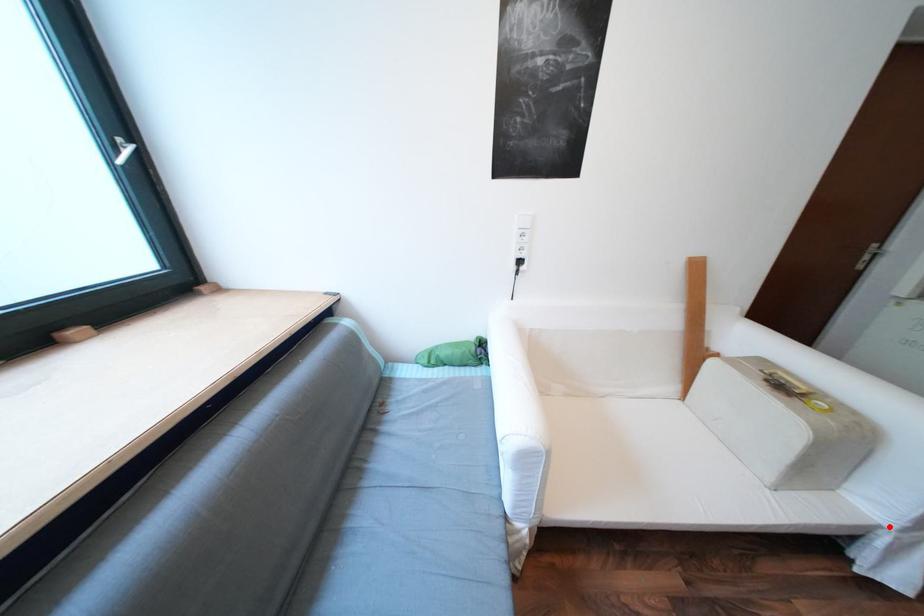
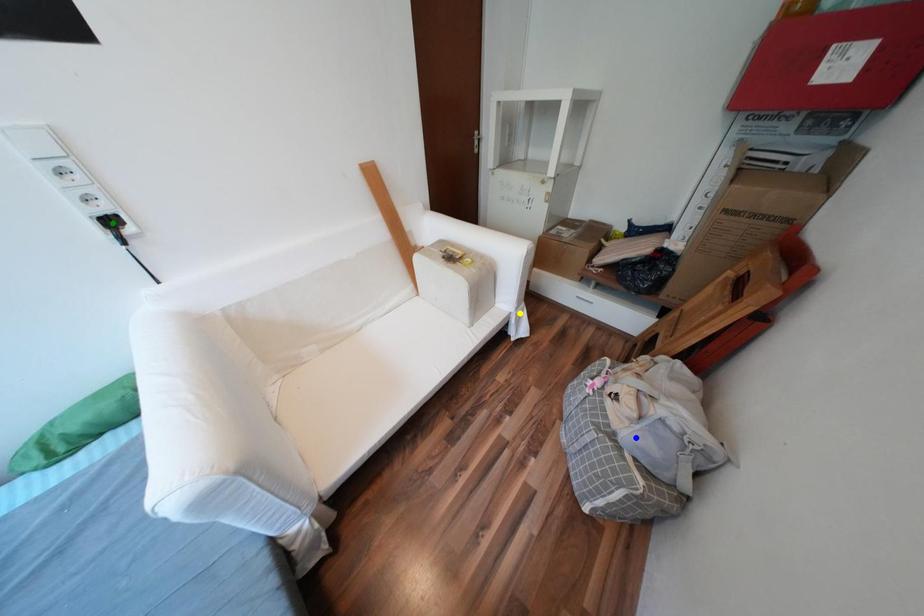
Question: I am providing you with two images of the same scene from different viewpoints. A red point is marked on the first image. You are given multiple points on the second image. Which spot in image 2 lines up with the point in image 1?

Choices:
 (A) green point
 (B) blue point
 (C) yellow point

Answer: (C)